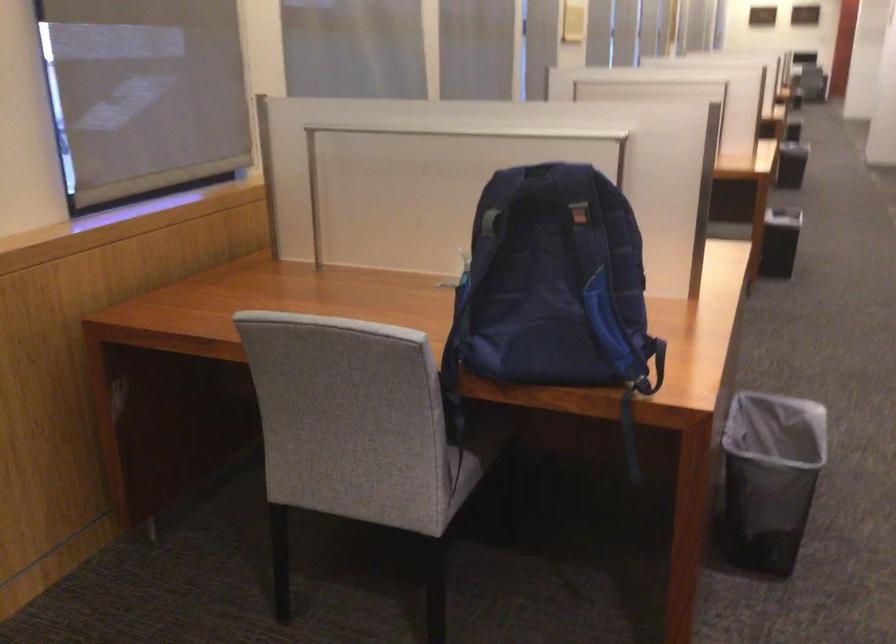
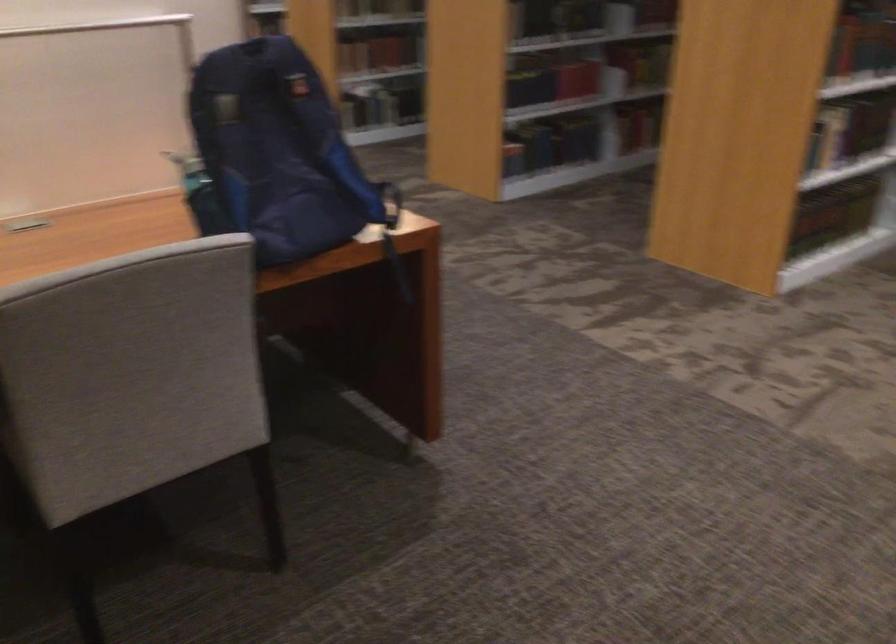
Locate, in the second image, the point that corresponds to (x=647, y=393) in the first image.

(392, 234)